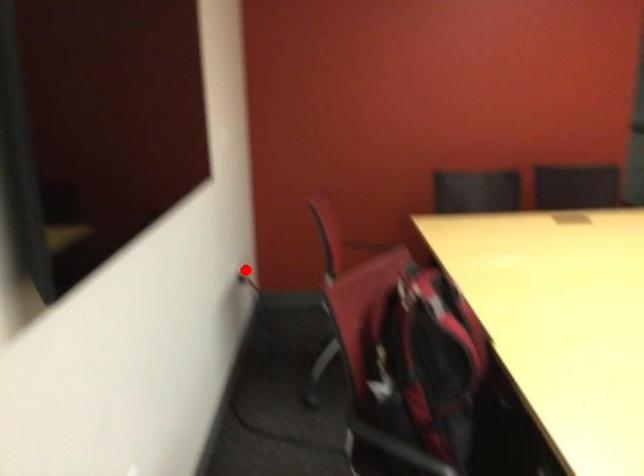
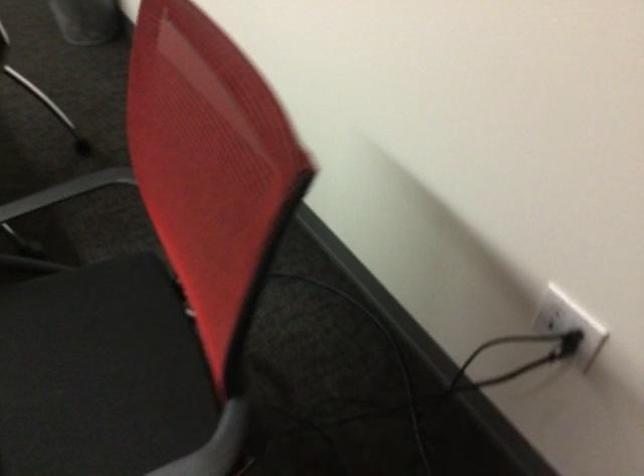
Question: I am providing you with two images of the same scene from different viewpoints. A red point is marked on the first image. Is the red point's position out of view in image 2?

Choices:
 (A) Yes
 (B) No

Answer: (B)